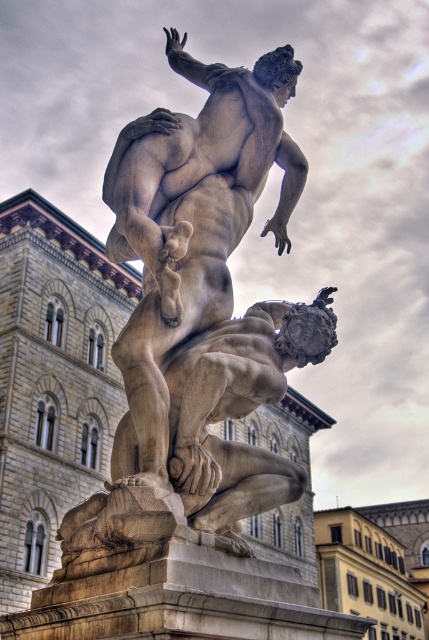
Is white marble statue at center to the left of smooth stone statue at center from the viewer's perspective?

In fact, white marble statue at center is to the right of smooth stone statue at center.

Can you confirm if white marble statue at center is thinner than smooth stone statue at center?

Correct, white marble statue at center's width is less than smooth stone statue at center's.

This screenshot has height=640, width=429. I want to click on white marble statue at center, so click(205, 282).

Image resolution: width=429 pixels, height=640 pixels. In order to click on white marble statue at center in this screenshot , I will do (x=205, y=282).